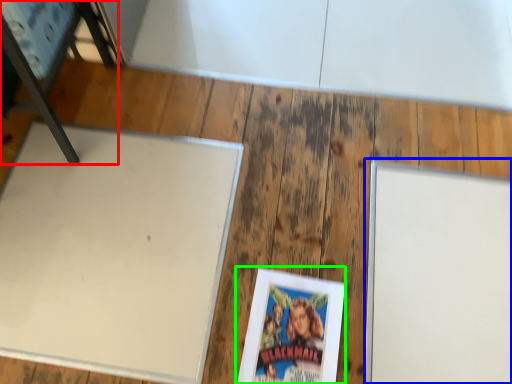
Question: Estimate the real-world distances between objects in this image. Which object is closer to furniture (highlighted by a red box), bulletin board (highlighted by a blue box) or paperback book (highlighted by a green box)?

Choices:
 (A) bulletin board
 (B) paperback book

Answer: (B)